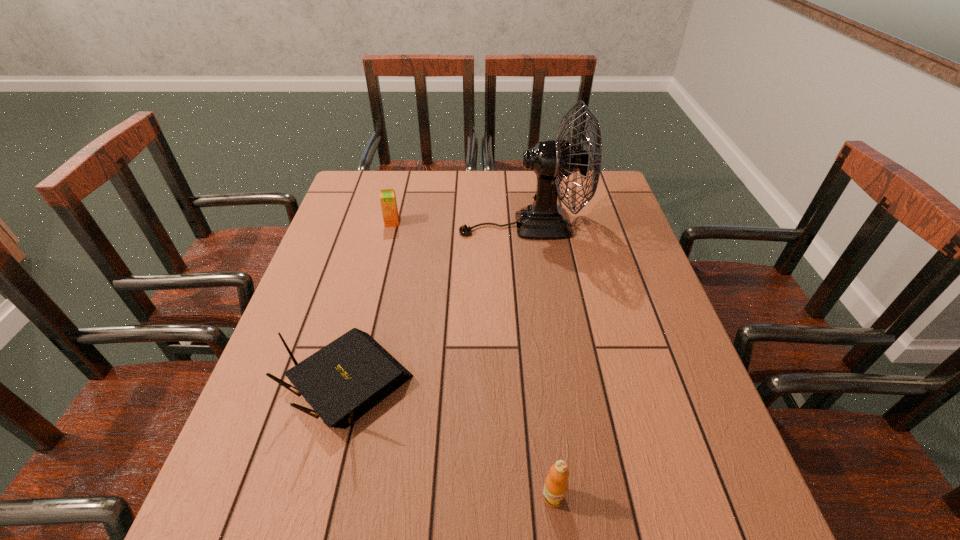
You are a GUI agent. You are given a task and a screenshot of the screen. Output one action in this format:
    pyautogui.click(x=<x>, y=<y>)
    Task: Click on the tallest object
    This screenshot has height=540, width=960.
    Given the screenshot: What is the action you would take?
    click(552, 160)

At what (x,y) coordinates should I click in order to perform the action: click on the left orange juice. Please return your answer as a coordinate pair (x, y). Image resolution: width=960 pixels, height=540 pixels. Looking at the image, I should click on (388, 202).

What are the coordinates of `the right orange juice` in the screenshot? It's located at (556, 484).

I want to click on the nearer orange juice, so click(556, 484).

You are a GUI agent. You are given a task and a screenshot of the screen. Output one action in this format:
    pyautogui.click(x=<x>, y=<y>)
    Task: Click on the second nearest object
    The width and height of the screenshot is (960, 540).
    Given the screenshot: What is the action you would take?
    pyautogui.click(x=345, y=379)

Find the location of `vacant space located in front of the fan, indicating the direction of air flow`. vacant space located in front of the fan, indicating the direction of air flow is located at coordinates (348, 225).

Identify the location of vacant space located 0.310m in front of the fan, indicating the direction of air flow. Image resolution: width=960 pixels, height=540 pixels. (357, 225).

Locate an element on the screen. The image size is (960, 540). free location located 0.190m in front of the fan, indicating the direction of air flow is located at coordinates (396, 225).

Locate an element on the screen. The width and height of the screenshot is (960, 540). vacant area situated on the front of the left orange juice is located at coordinates (383, 258).

This screenshot has width=960, height=540. I want to click on vacant area situated on the back of the third farthest object, so click(x=370, y=299).